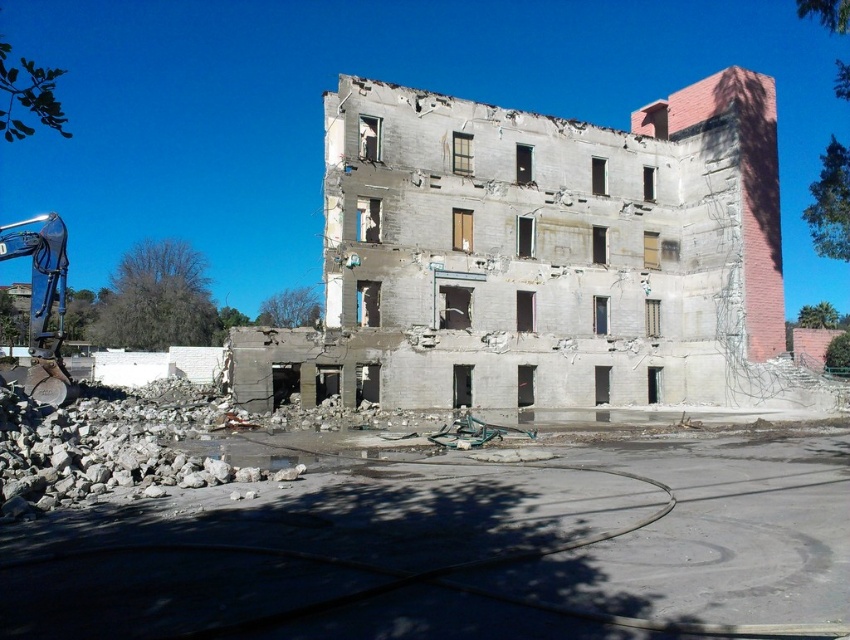
Does point (497, 458) come farther from viewer compared to point (55, 392)?

No, it is not.

Identify the location of crumbled concrete debris at lower left. (442, 544).